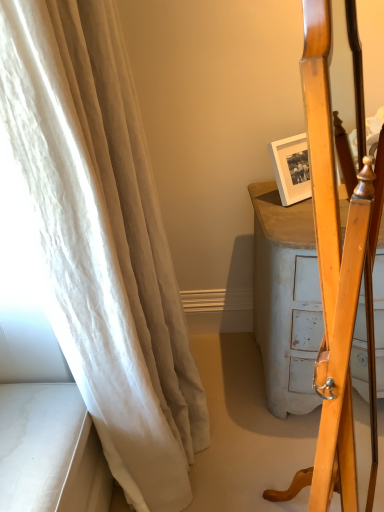
Measure the distance between point (74,341) and camera.

Point (74,341) and camera are 3.40 feet apart.

What do you see at coordinates (102, 240) in the screenshot? I see `white sheer curtain at left` at bounding box center [102, 240].

This screenshot has height=512, width=384. I want to click on white sheer curtain at left, so click(x=102, y=240).

What do you see at coordinates (338, 267) in the screenshot?
I see `wooden mirror at right` at bounding box center [338, 267].

The height and width of the screenshot is (512, 384). Find the location of `wooden mirror at right`. wooden mirror at right is located at coordinates (338, 267).

At what (x,y) coordinates should I click in order to perform the action: click on white sheer curtain at left. Please return your answer as a coordinate pair (x, y). Image resolution: width=384 pixels, height=512 pixels. Looking at the image, I should click on (102, 240).

Considering the positions of objects white sheer curtain at left and wooden mirror at right in the image provided, who is more to the right, white sheer curtain at left or wooden mirror at right?

wooden mirror at right is more to the right.

Which object is further away from the camera, white sheer curtain at left or wooden mirror at right?

Positioned behind is white sheer curtain at left.

Does point (22, 183) appear closer or farther from the camera than point (367, 264)?

Point (22, 183) is farther from the camera than point (367, 264).

From the picture: From the image's perspective, relative to wooden mirror at right, is white sheer curtain at left above or below?

Based on their image positions, white sheer curtain at left is located above wooden mirror at right.

From a real-world perspective, which is physically below, white sheer curtain at left or wooden mirror at right?

From a 3D spatial view, wooden mirror at right is below.

Considering the relative sizes of white sheer curtain at left and wooden mirror at right in the image provided, is white sheer curtain at left thinner than wooden mirror at right?

In fact, white sheer curtain at left might be wider than wooden mirror at right.

From their relative heights in the image, would you say white sheer curtain at left is taller or shorter than wooden mirror at right?

In the image, white sheer curtain at left appears to be taller than wooden mirror at right.

Considering the sizes of objects white sheer curtain at left and wooden mirror at right in the image provided, who is bigger, white sheer curtain at left or wooden mirror at right?

white sheer curtain at left.

Is white sheer curtain at left surrounding wooden mirror at right?

No, wooden mirror at right is not inside white sheer curtain at left.

Is white sheer curtain at left touching wooden mirror at right?

No, white sheer curtain at left is not next to wooden mirror at right.

Is white sheer curtain at left turned away from wooden mirror at right?

No.

How much distance is there between white sheer curtain at left and wooden mirror at right?

They are 22.86 inches apart.

Find the location of a particular element. curtain that appears above the wooden mirror at right (from a real-world perspective) is located at coordinates (102, 240).

Consider the image. Considering the positions of objects wooden mirror at right and white sheer curtain at left in the image provided, who is more to the right, wooden mirror at right or white sheer curtain at left?

wooden mirror at right is more to the right.

Relative to white sheer curtain at left, is wooden mirror at right in front or behind?

Clearly, wooden mirror at right is in front of white sheer curtain at left.

Does point (362, 225) come farther from viewer compared to point (17, 127)?

No, it is in front of (17, 127).

From the image's perspective, which is below, wooden mirror at right or white sheer curtain at left?

wooden mirror at right appears lower in the image.

From a real-world perspective, is wooden mirror at right positioned above or below white sheer curtain at left?

wooden mirror at right is below white sheer curtain at left.

In terms of width, does wooden mirror at right look wider or thinner when compared to white sheer curtain at left?

wooden mirror at right is thinner than white sheer curtain at left.

From their relative heights in the image, would you say wooden mirror at right is taller or shorter than white sheer curtain at left?

In the image, wooden mirror at right appears to be shorter than white sheer curtain at left.

Between wooden mirror at right and white sheer curtain at left, which one has larger size?

white sheer curtain at left is bigger.

Is wooden mirror at right inside or outside of white sheer curtain at left?

wooden mirror at right lies outside white sheer curtain at left.

Are wooden mirror at right and white sheer curtain at left far apart?

No.

Is wooden mirror at right aimed at white sheer curtain at left?

No, wooden mirror at right is not facing towards white sheer curtain at left.

Image resolution: width=384 pixels, height=512 pixels. What are the coordinates of `curtain that appears above the wooden mirror at right (from a real-world perspective)` in the screenshot? It's located at (102, 240).

Identify the location of curtain above the wooden mirror at right (from the image's perspective). (102, 240).

This screenshot has height=512, width=384. I want to click on curtain above the wooden mirror at right (from a real-world perspective), so point(102,240).